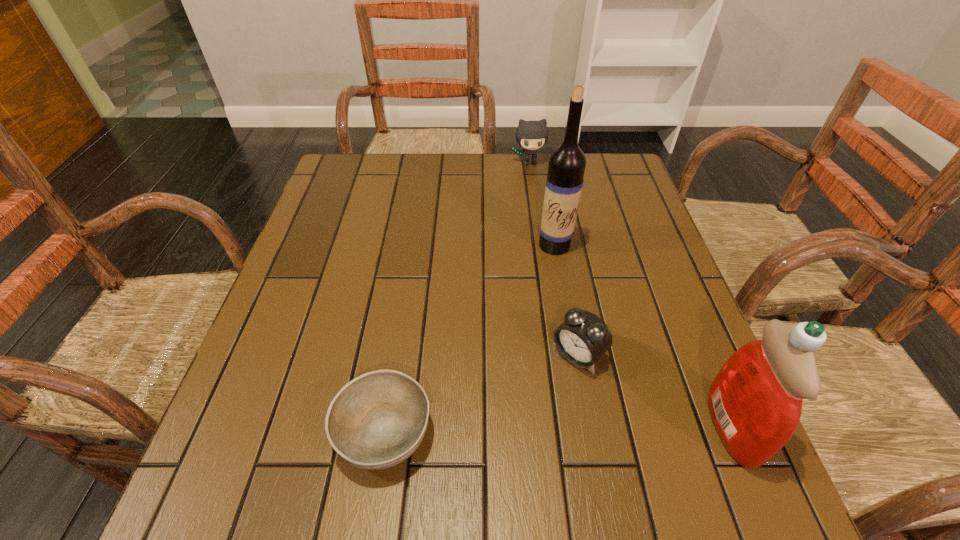
Find the location of `vacant region between the kitten and the alarm clock`. vacant region between the kitten and the alarm clock is located at coordinates (554, 259).

Where is `vacant area between the kitten and the fourth nearest object`? The width and height of the screenshot is (960, 540). vacant area between the kitten and the fourth nearest object is located at coordinates tap(542, 204).

Select which object appears as the third closest to the second tallest object. Please provide its 2D coordinates. Your answer should be formatted as a tuple, i.e. [(x, y)], where the tuple contains the x and y coordinates of a point satisfying the conditions above.

[(377, 420)]

Find the location of a particular element. object that is the closest one to the fourth tallest object is located at coordinates (755, 401).

Identify the location of vacant region that satisfies the following two spatial constraints: 1. on the front side of the rightmost object; 2. on the front surface of the third tallest object. The image size is (960, 540). (568, 426).